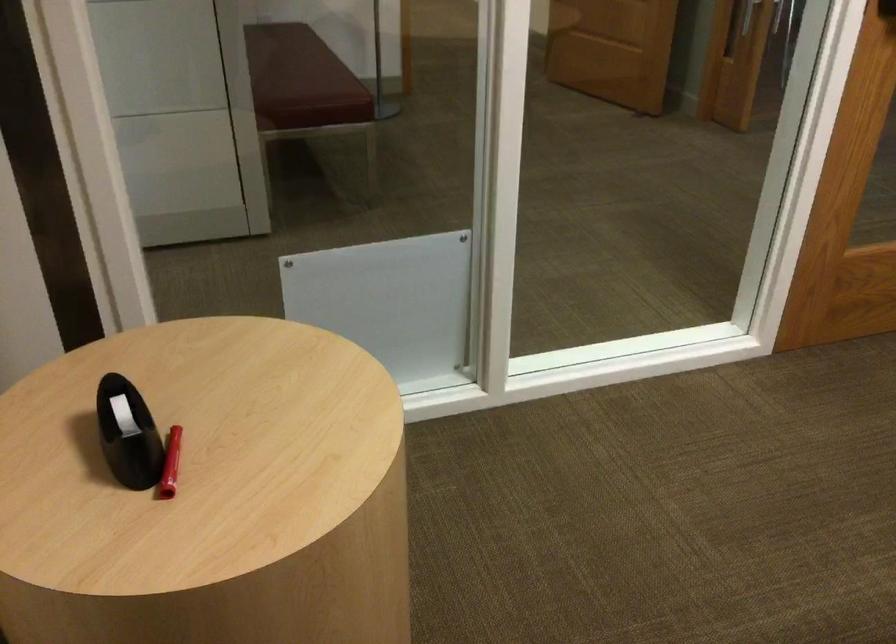
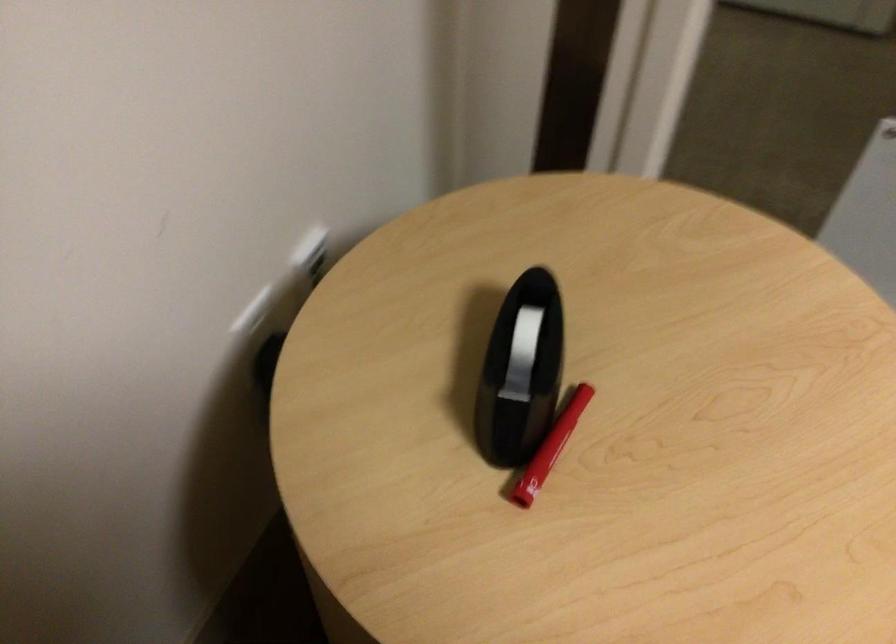
Find the pixel in the second image that matches (171,462) in the first image.

(557, 438)